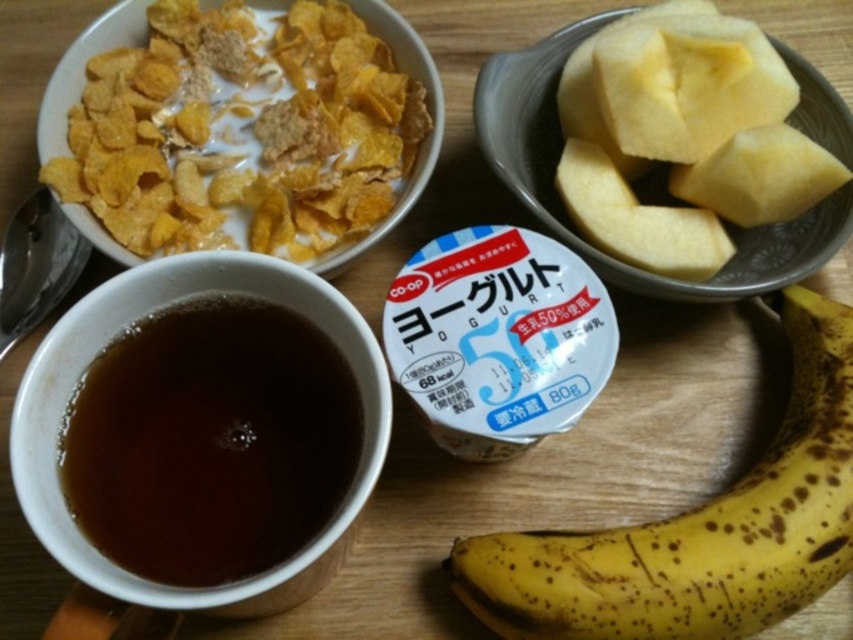
Question: Does brown spotted banana at lower right lie behind yellow matte apple at upper right?

Choices:
 (A) no
 (B) yes

Answer: (A)

Question: Observing the image, what is the correct spatial positioning of brown matte cup at lower left in reference to brown spotted banana at lower right?

Choices:
 (A) below
 (B) above

Answer: (B)

Question: Considering the real-world distances, which object is farthest from the yellow matte apple at upper right?

Choices:
 (A) brown spotted banana at lower right
 (B) yellow matte corn flakes at upper left
 (C) brown matte cup at lower left

Answer: (C)

Question: Among these objects, which one is farthest from the camera?

Choices:
 (A) brown spotted banana at lower right
 (B) yellow matte apple at upper right

Answer: (B)

Question: Does brown matte cup at lower left have a smaller size compared to yellow matte apple at upper right?

Choices:
 (A) no
 (B) yes

Answer: (B)

Question: Which point is farther to the camera?

Choices:
 (A) brown matte cup at lower left
 (B) yellow matte corn flakes at upper left

Answer: (B)